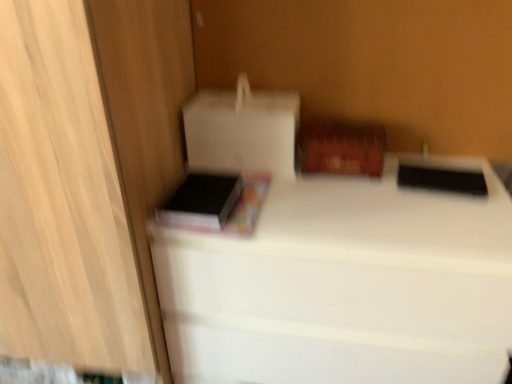
Locate an element on the screen. This screenshot has width=512, height=384. unoccupied space behind black matte book at left is located at coordinates (220, 173).